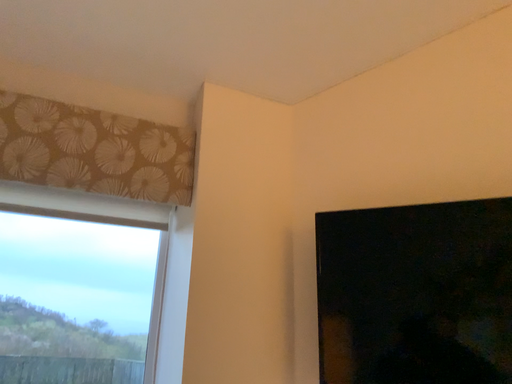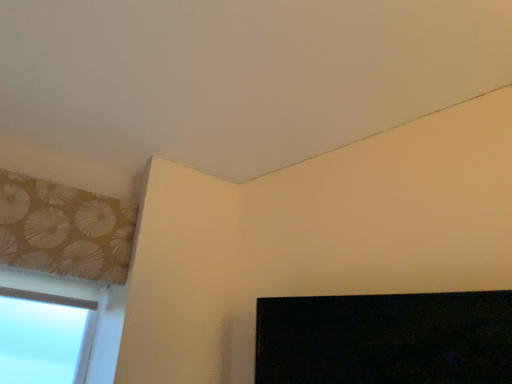
Question: How did the camera likely rotate when shooting the video?

Choices:
 (A) rotated upward
 (B) rotated downward

Answer: (A)